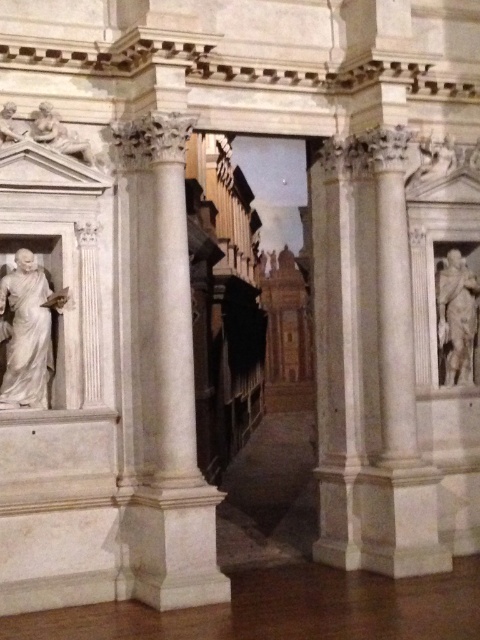
You are standing in the classical interior space and want to locate the white marble statue at left. According to the coordinates provided, where should you look relative to the columns?

The white marble statue at left is positioned at coordinates point (26, 332), which means it is located to the left side near the base of the columns.

You are standing in the interior space and want to take a photo of the white marble statue at left. If your camera can focus on objects up to 6 meters away, will it be able to capture the statue clearly?

The white marble statue at left is 6.41 meters from viewer, which is beyond the camera focus range of 6 meters. Therefore, the camera cannot capture the statue clearly.

You are an art historian examining the statues in the classical interior. You notice both the white marble statue at left and the white marble statue at right. Based on their positions, which one is positioned lower in the image?

The white marble statue at left is located below the white marble statue at right, meaning it is positioned lower in the image.